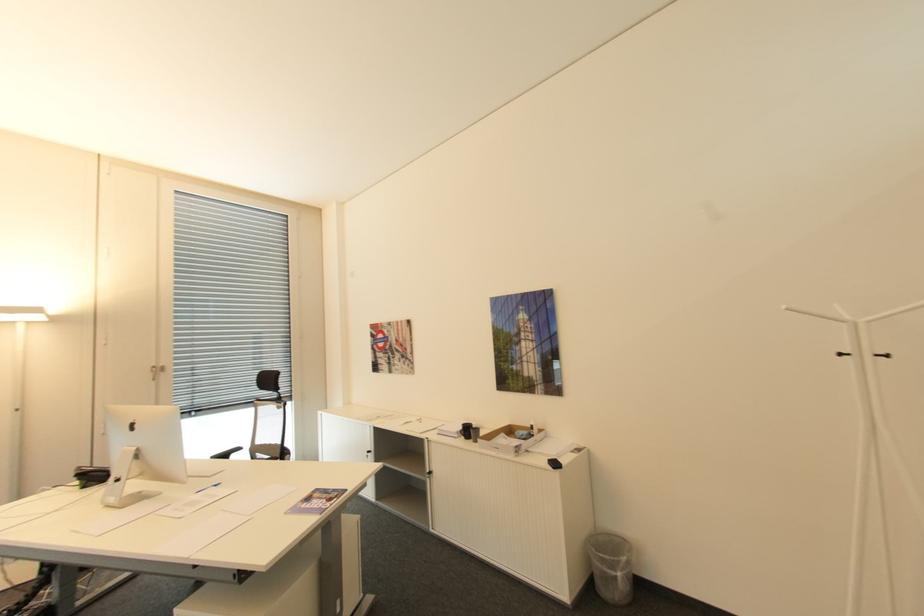
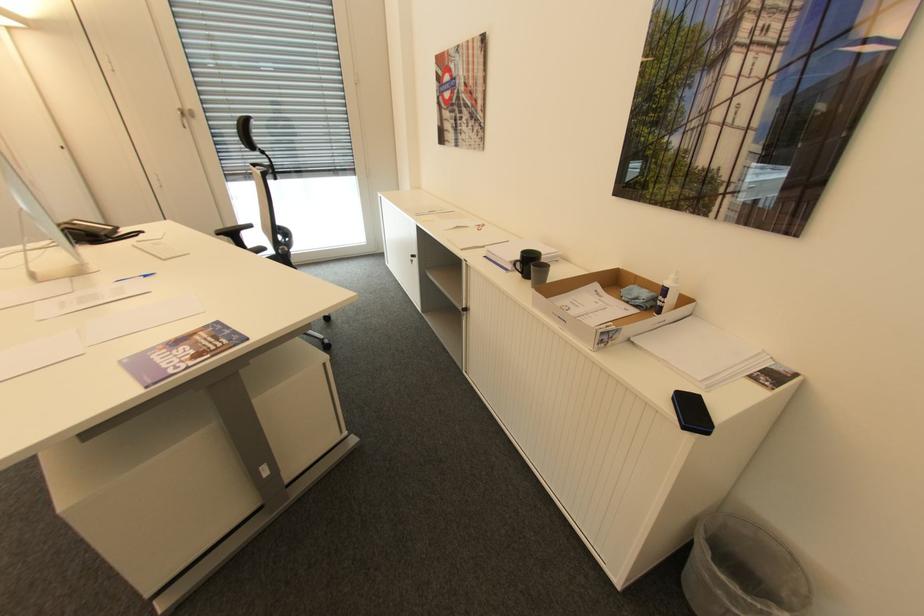
The point at (220, 485) is marked in the first image. Where is the corresponding point in the second image?

(150, 276)